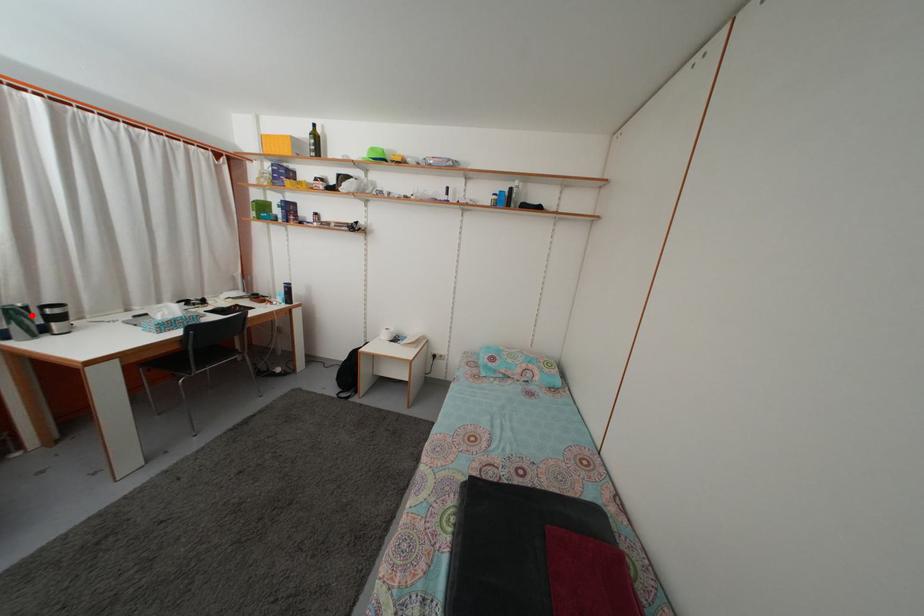
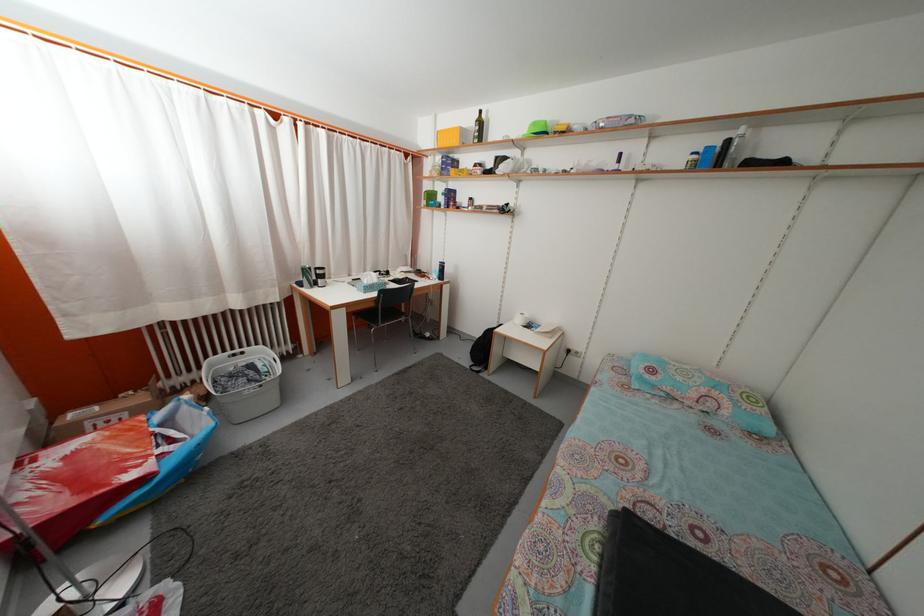
Question: I am providing you with two images of the same scene from different viewpoints. A red point is marked on the first image. At the location where the point appears in image 1, is it still visible in image 2?

Choices:
 (A) Yes
 (B) No

Answer: (A)